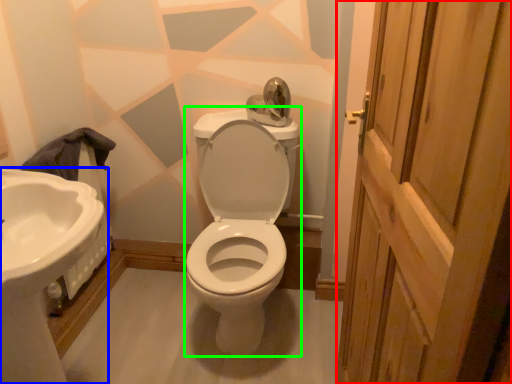
Question: Based on their relative distances, which object is farther from screen door (highlighted by a red box)? Choose from sink (highlighted by a blue box) and porcelain (highlighted by a green box).

Choices:
 (A) sink
 (B) porcelain

Answer: (A)